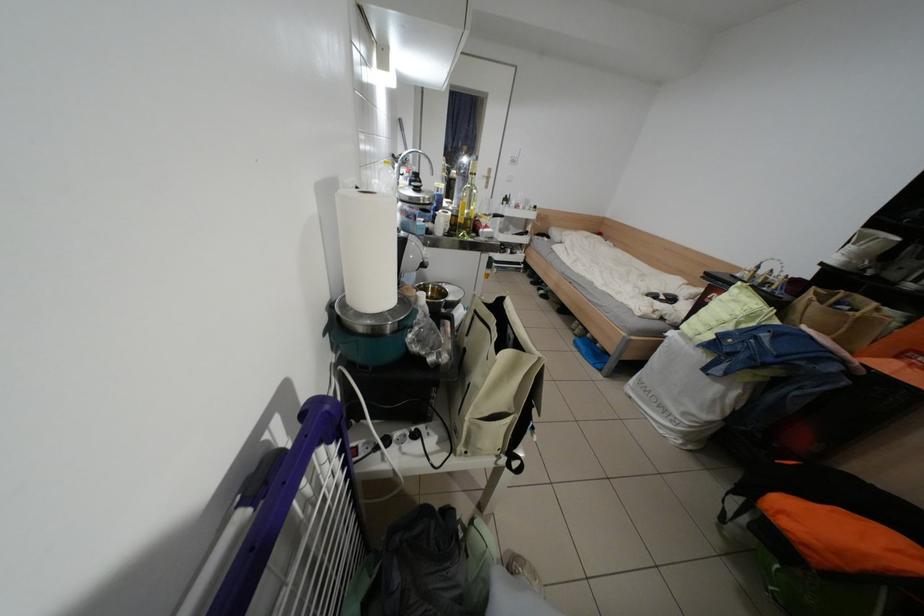
I want to click on red power switch, so click(359, 448).